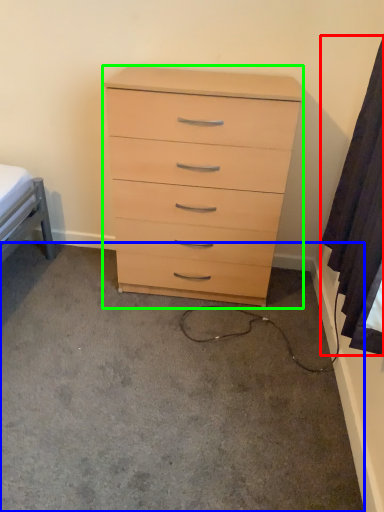
Question: Which object is positioned closest to curtain (highlighted by a red box)? Select from concrete (highlighted by a blue box) and chest of drawers (highlighted by a green box).

Choices:
 (A) concrete
 (B) chest of drawers

Answer: (B)